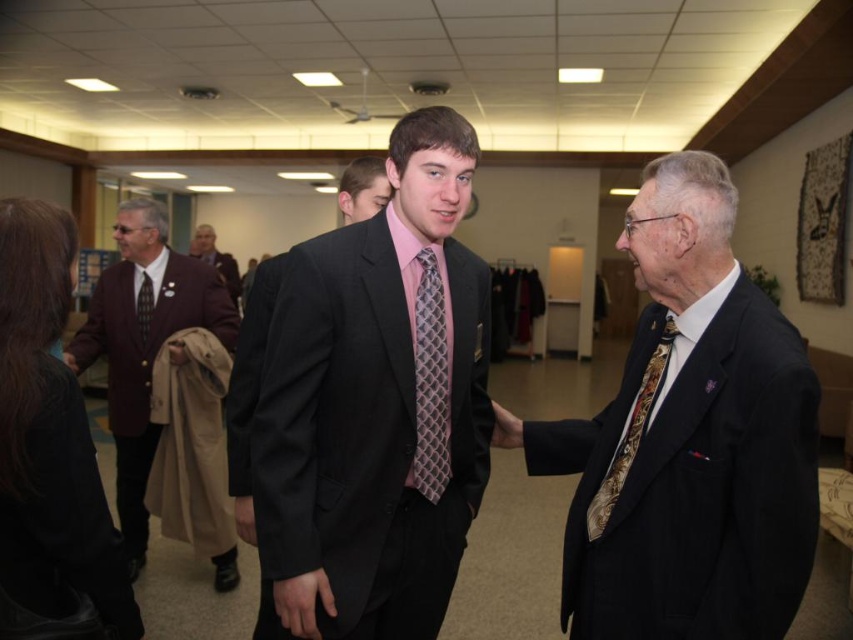
You are a photographer at the event and want to take a photo of the smooth leather hand at center and the matte black tie at left. Based on their positions, which object should be placed on the right side of the photo?

The smooth leather hand at center should be placed on the right side of the photo because it is to the right of the matte black tie at left.

You are a photographer at the event and need to capture a clear photo of the matte black suit at center without the smooth leather hand at center blocking it. How can you adjust your position to achieve this?

The matte black suit at center is positioned over the smooth leather hand at center, so you can move your camera slightly downward to frame the suit while avoiding the hand.